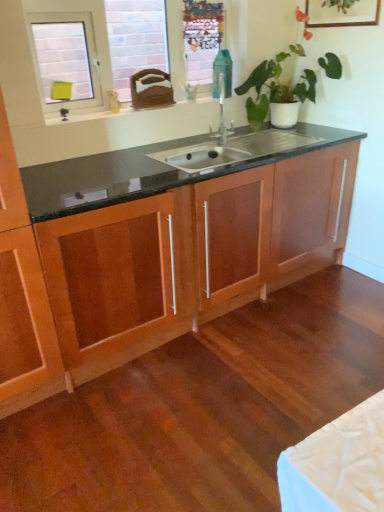
Question: From the image's perspective, relative to metallic mesh at upper center, is wooden cabinet at center above or below?

Choices:
 (A) above
 (B) below

Answer: (B)

Question: Is point (349, 203) positioned closer to the camera than point (215, 29)?

Choices:
 (A) farther
 (B) closer

Answer: (A)

Question: Estimate the real-world distances between objects in this image. Which object is closer to the wooden cabinet at center?

Choices:
 (A) wooden picture frame at upper right
 (B) white glossy window at upper left
 (C) white glossy window sill at upper left
 (D) green glossy plant at upper center
 (E) metallic mesh at upper center

Answer: (C)

Question: Estimate the real-world distances between objects in this image. Which object is farther from the wooden cabinet at center?

Choices:
 (A) metallic mesh at upper center
 (B) white glossy window at upper left
 (C) white glossy window sill at upper left
 (D) wooden picture frame at upper right
 (E) green glossy plant at upper center

Answer: (D)